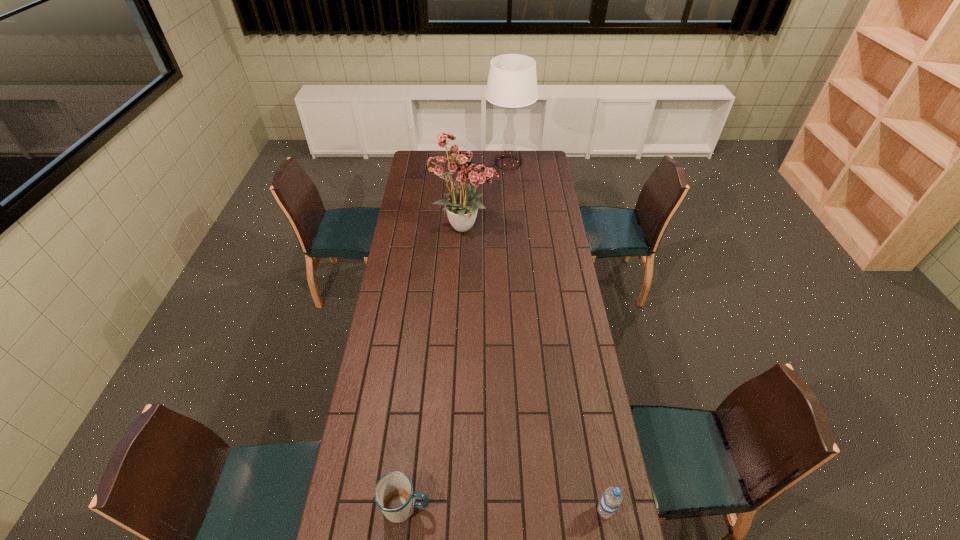
I want to click on vacant area that lies between the rightmost object and the shortest object, so click(x=506, y=508).

The height and width of the screenshot is (540, 960). What are the coordinates of `vacant space in between the mug and the farthest object` in the screenshot? It's located at (457, 335).

Image resolution: width=960 pixels, height=540 pixels. What are the coordinates of `free space between the table lamp and the flower arrangement` in the screenshot? It's located at (487, 195).

Find the location of a particular element. Image resolution: width=960 pixels, height=540 pixels. vacant area that lies between the mug and the farthest object is located at coordinates (457, 335).

Where is `vacant area that lies between the flower arrangement and the table lamp`? This screenshot has height=540, width=960. vacant area that lies between the flower arrangement and the table lamp is located at coordinates (487, 195).

I want to click on unoccupied area between the rightmost object and the mug, so click(506, 508).

Find the location of a particular element. The width and height of the screenshot is (960, 540). vacant point located between the water bottle and the table lamp is located at coordinates (557, 337).

Where is `free space that is in between the third tallest object and the farthest object`? The height and width of the screenshot is (540, 960). free space that is in between the third tallest object and the farthest object is located at coordinates (557, 337).

At what (x,y) coordinates should I click in order to perform the action: click on blank region between the table lamp and the third nearest object. Please return your answer as a coordinate pair (x, y). This screenshot has width=960, height=540. Looking at the image, I should click on (487, 195).

Select which object appears as the third closest to the second shortest object. Please provide its 2D coordinates. Your answer should be formatted as a tuple, i.e. [(x, y)], where the tuple contains the x and y coordinates of a point satisfying the conditions above.

[(512, 82)]